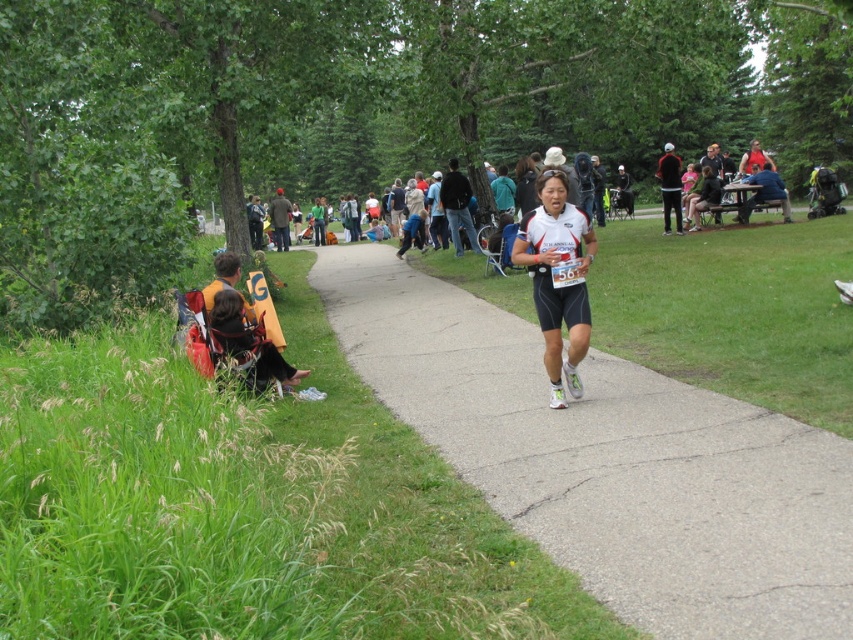
Is gray asphalt pavement at center smaller than black matte jacket at upper right?

Actually, gray asphalt pavement at center might be larger than black matte jacket at upper right.

Is gray asphalt pavement at center to the right of black matte jacket at upper right from the viewer's perspective?

Incorrect, gray asphalt pavement at center is not on the right side of black matte jacket at upper right.

Locate an element on the screen. The height and width of the screenshot is (640, 853). gray asphalt pavement at center is located at coordinates (610, 460).

The height and width of the screenshot is (640, 853). I want to click on gray asphalt pavement at center, so click(610, 460).

Is point (575, 385) closer to viewer compared to point (677, 220)?

Yes, it is.

From the picture: Is white matte running outfit at center behind black matte jacket at upper right?

A: No.

At what (x,y) coordinates should I click in order to perform the action: click on white matte running outfit at center. Please return your answer as a coordinate pair (x, y). This screenshot has width=853, height=640. Looking at the image, I should click on (556, 278).